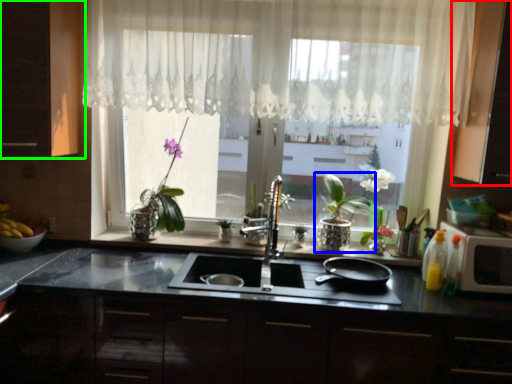
Question: Estimate the real-world distances between objects in this image. Which object is farther from cabinetry (highlighted by a red box), houseplant (highlighted by a blue box) or cabinetry (highlighted by a green box)?

Choices:
 (A) houseplant
 (B) cabinetry

Answer: (B)